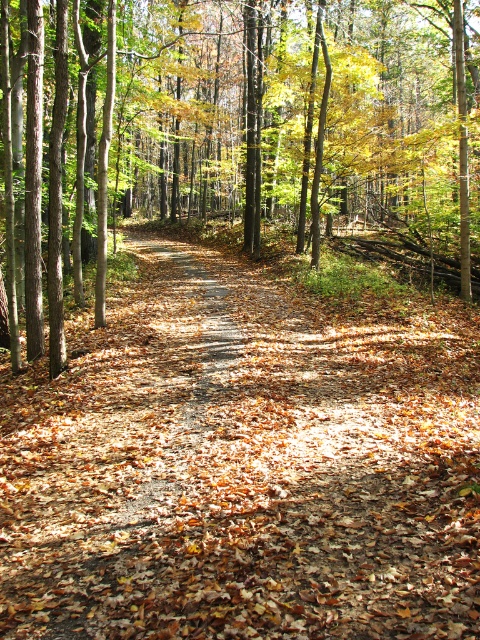
Which of these two, brown leafy forest path at center or brown leaf litter at center, stands shorter?

Standing shorter between the two is brown leafy forest path at center.

Is brown leafy forest path at center further to camera compared to brown leaf litter at center?

No, it is in front of brown leaf litter at center.

At what (x,y) coordinates should I click in order to perform the action: click on brown leafy forest path at center. Please return your answer as a coordinate pair (x, y). The width and height of the screenshot is (480, 640). Looking at the image, I should click on (242, 467).

Where is `brown leafy forest path at center`? The width and height of the screenshot is (480, 640). brown leafy forest path at center is located at coordinates (242, 467).